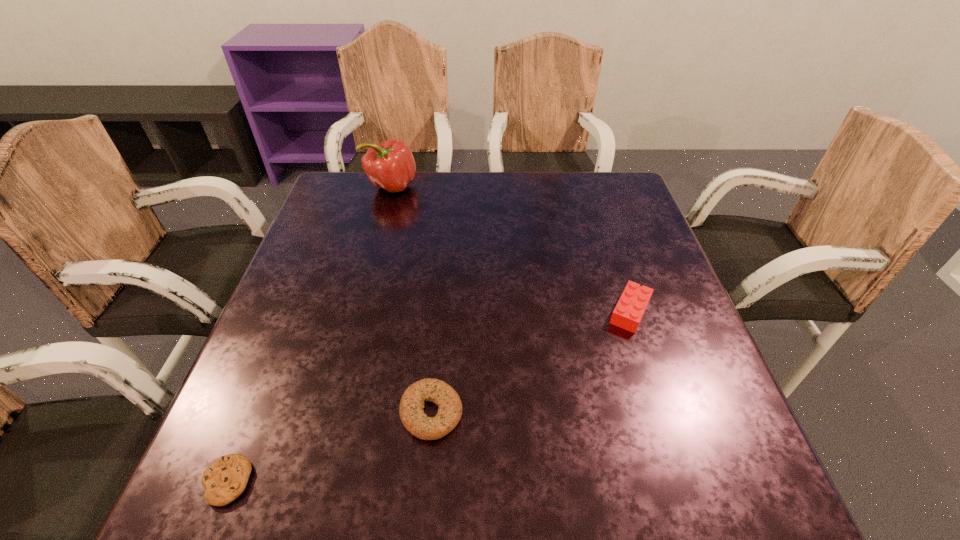
Where is `free location located on the back of the third farthest object`? The height and width of the screenshot is (540, 960). free location located on the back of the third farthest object is located at coordinates (444, 265).

I want to click on free space located 0.390m on the right of the cookie, so click(x=497, y=481).

This screenshot has width=960, height=540. In order to click on object that is at the far edge in this screenshot , I will do `click(390, 165)`.

Locate an element on the screen. Image resolution: width=960 pixels, height=540 pixels. object present at the near edge is located at coordinates (225, 479).

I want to click on pepper present at the left edge, so click(390, 165).

Image resolution: width=960 pixels, height=540 pixels. I want to click on cookie present at the left edge, so click(225, 479).

At what (x,y) coordinates should I click in order to perform the action: click on object positioned at the right edge. Please return your answer as a coordinate pair (x, y). The width and height of the screenshot is (960, 540). Looking at the image, I should click on (x=634, y=300).

Where is `object that is at the far left corner`? The width and height of the screenshot is (960, 540). object that is at the far left corner is located at coordinates (390, 165).

Identify the location of object situated at the near left corner. (225, 479).

You are a GUI agent. You are given a task and a screenshot of the screen. Output one action in this format:
    pyautogui.click(x=<x>, y=<y>)
    Task: Click on the free space at the far edge of the desktop
    This screenshot has width=960, height=540.
    Given the screenshot: What is the action you would take?
    pyautogui.click(x=535, y=214)